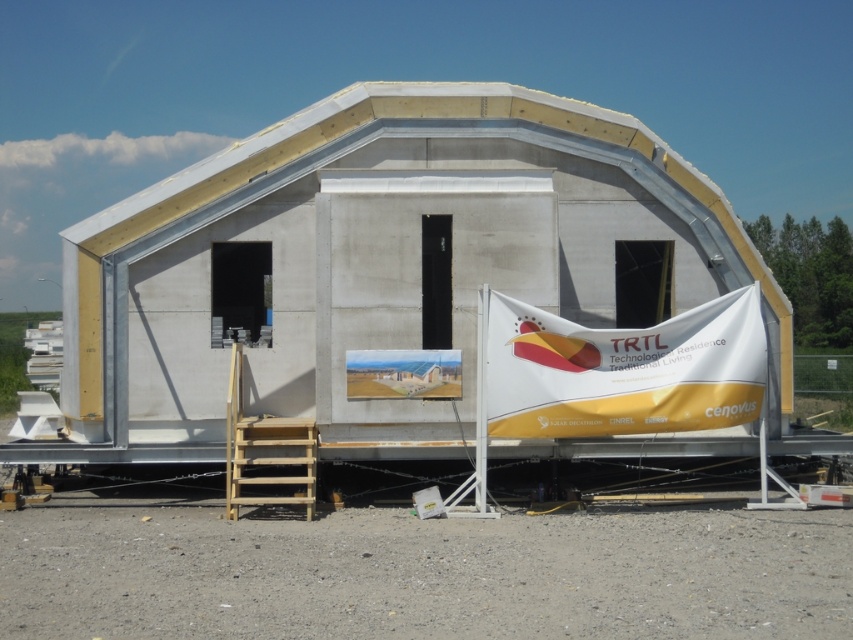
Locate an element on the screen. The image size is (853, 640). white concrete hut at center is located at coordinates (383, 259).

Is the position of white concrete hut at center less distant than that of white/yellow fabric banner at center?

No, it is behind white/yellow fabric banner at center.

Find the location of a particular element. Image resolution: width=853 pixels, height=640 pixels. white concrete hut at center is located at coordinates (383, 259).